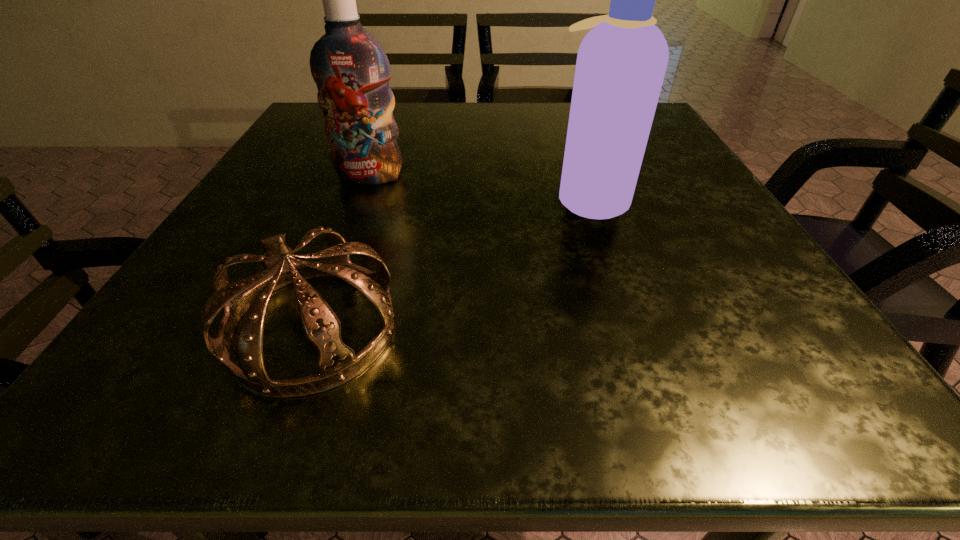
Where is `object positioned at the right edge`? The width and height of the screenshot is (960, 540). object positioned at the right edge is located at coordinates (621, 63).

Locate an element on the screen. object that is at the near left corner is located at coordinates (337, 364).

You are a GUI agent. You are given a task and a screenshot of the screen. Output one action in this format:
    pyautogui.click(x=<x>, y=<y>)
    Task: Click on the free space at the far edge
    This screenshot has width=960, height=540.
    Given the screenshot: What is the action you would take?
    pyautogui.click(x=435, y=107)

Locate an element on the screen. The image size is (960, 540). free space at the near edge of the desktop is located at coordinates (285, 410).

This screenshot has width=960, height=540. In the image, there is a desktop. Identify the location of vacant space at the left edge. (321, 177).

This screenshot has height=540, width=960. In the image, there is a desktop. What are the coordinates of `vacant space at the right edge` in the screenshot? It's located at (696, 324).

Image resolution: width=960 pixels, height=540 pixels. I want to click on free space at the far left corner of the desktop, so [296, 133].

The width and height of the screenshot is (960, 540). Identify the location of blank region between the shortest object and the right shampoo. (451, 263).

The image size is (960, 540). What are the coordinates of `free area in between the right shampoo and the nearest object` in the screenshot? It's located at (451, 263).

Identify the location of vacant region between the right shampoo and the left shampoo. (480, 187).